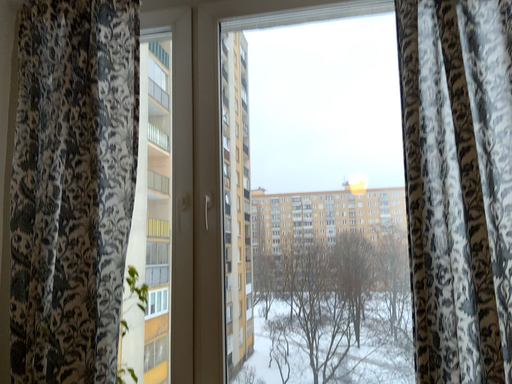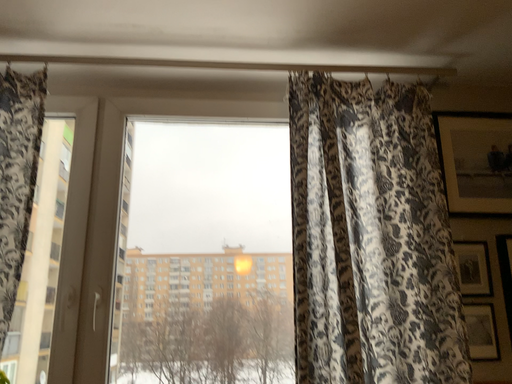
Question: How did the camera likely rotate when shooting the video?

Choices:
 (A) rotated downward
 (B) rotated upward

Answer: (B)